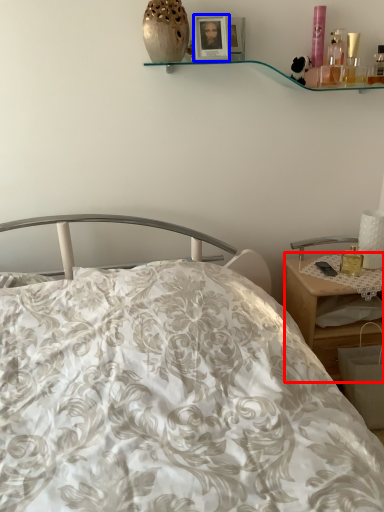
Question: Which of the following is the closest to the observer, desk (highlighted by a red box) or picture frame (highlighted by a blue box)?

Choices:
 (A) desk
 (B) picture frame

Answer: (B)